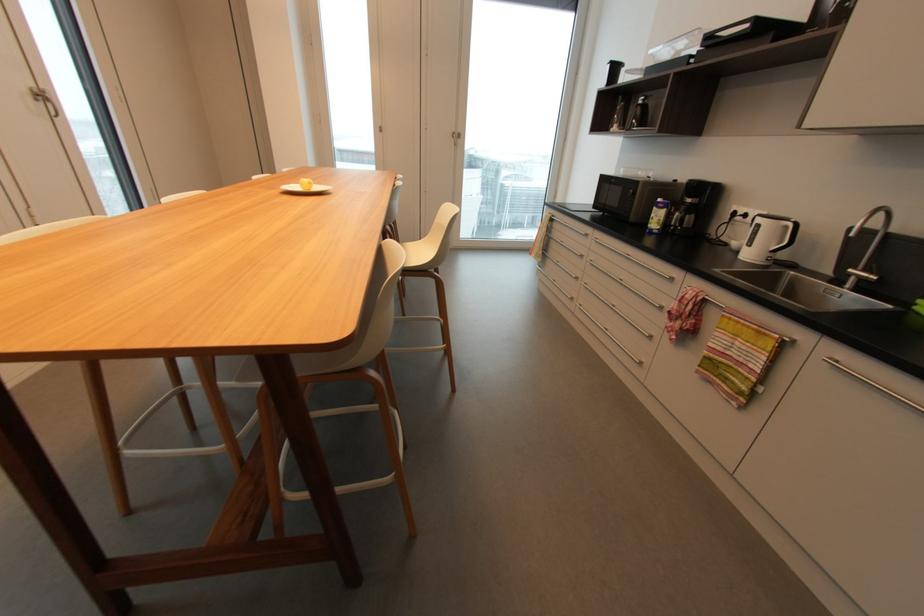
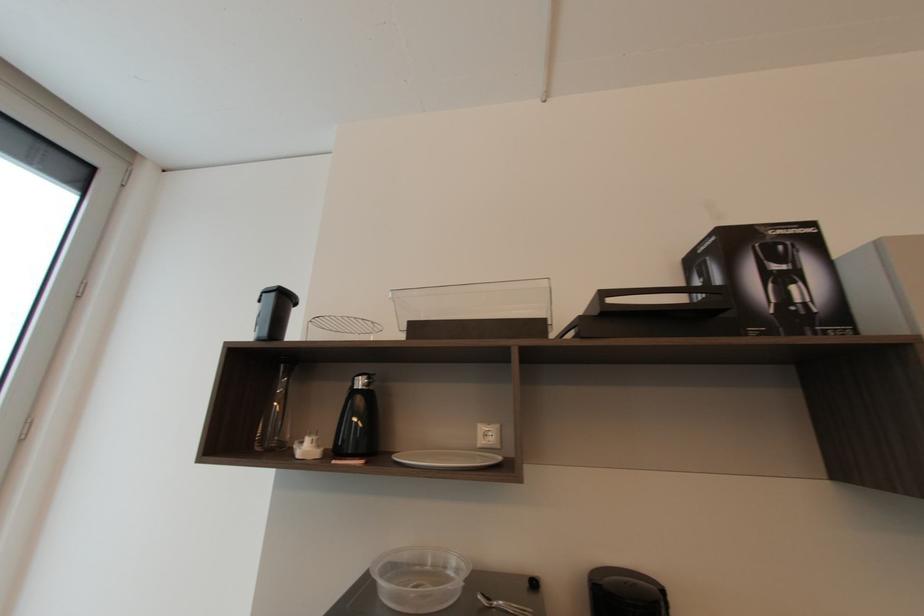
Where in the second image is the point corresponding to point 645,100 from the first image?

(362, 384)